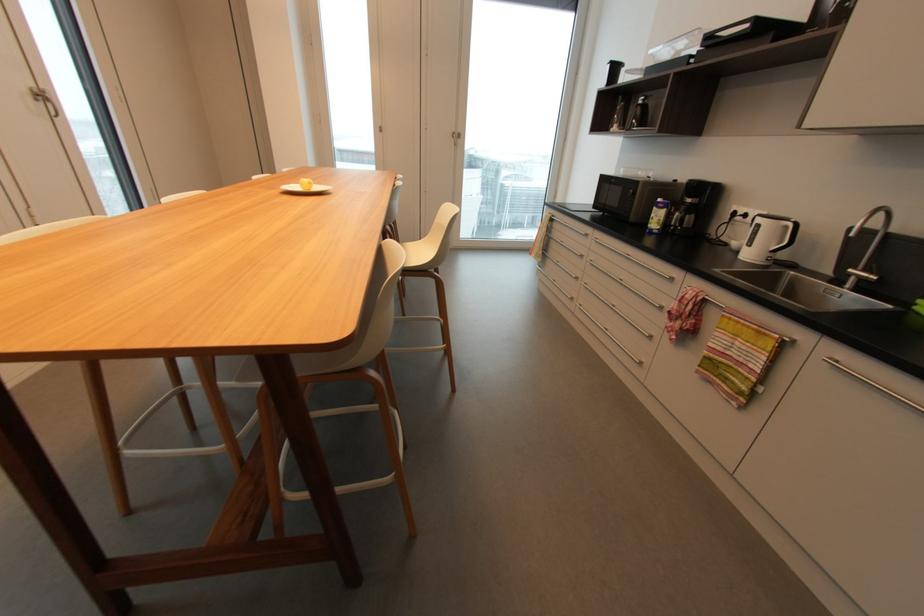
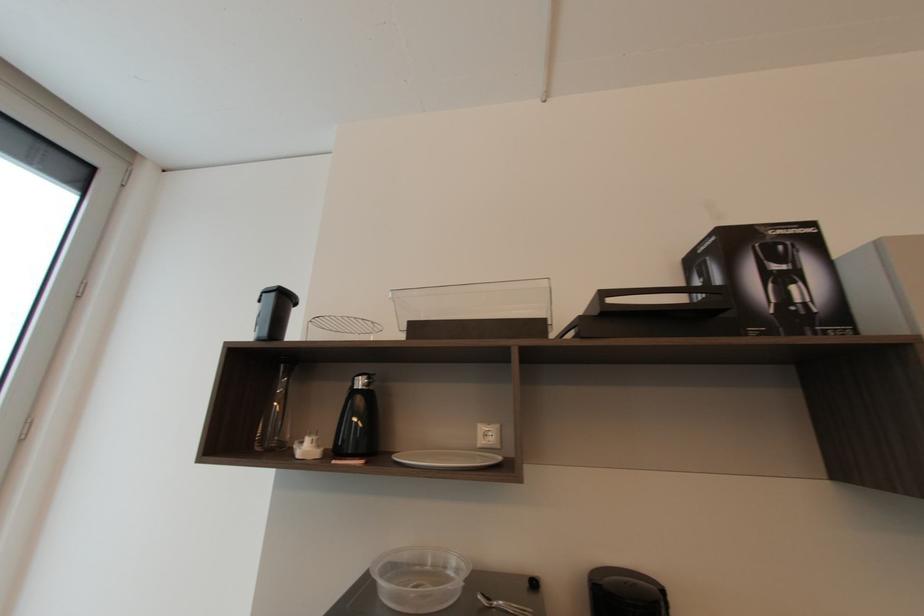
Where in the second image is the point corresponding to point 645,100 from the first image?

(362, 384)